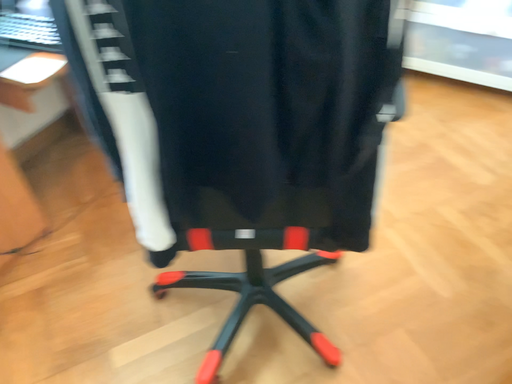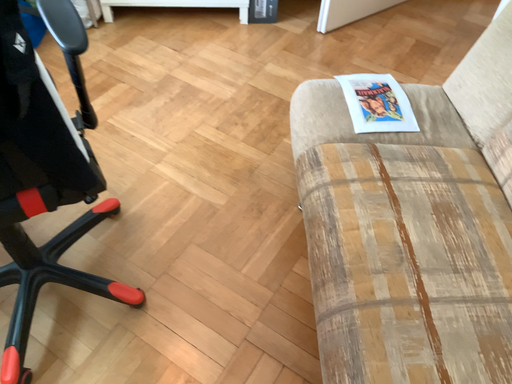
Question: How did the camera likely rotate when shooting the video?

Choices:
 (A) rotated left
 (B) rotated right

Answer: (B)